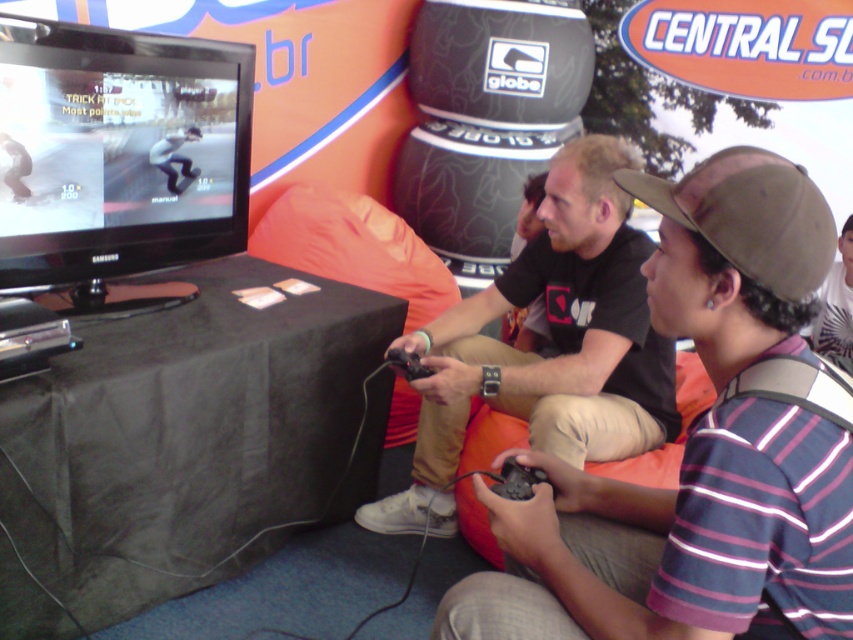
Which is above, black matte shirt at center or brown fabric baseball cap at center-right?

brown fabric baseball cap at center-right is higher up.

Find the location of a particular element. black matte shirt at center is located at coordinates (548, 344).

Is point (512, 387) positioned behind point (776, 200)?

Yes, it is behind point (776, 200).

At what (x,y) coordinates should I click in order to perform the action: click on black matte shirt at center. Please return your answer as a coordinate pair (x, y). Looking at the image, I should click on (548, 344).

Is striped cotton shirt at center positioned before black matte shirt at center?

That is True.

What do you see at coordinates (676, 541) in the screenshot?
I see `striped cotton shirt at center` at bounding box center [676, 541].

You are a GUI agent. You are given a task and a screenshot of the screen. Output one action in this format:
    pyautogui.click(x=<x>, y=<y>)
    Task: Click on the striped cotton shirt at center
    
    Given the screenshot: What is the action you would take?
    pyautogui.click(x=676, y=541)

Where is `striped cotton shirt at center`? striped cotton shirt at center is located at coordinates (676, 541).

Between point (793, 298) and point (654, 182), which one is positioned in front?

Positioned in front is point (793, 298).

Does point (762, 339) come closer to viewer compared to point (747, 177)?

No, it is not.

Which is behind, point (665, 257) or point (761, 182)?

Point (665, 257)

You are a GUI agent. You are given a task and a screenshot of the screen. Output one action in this format:
    pyautogui.click(x=<x>, y=<y>)
    Task: Click on the striped cotton shirt at center
    The image size is (853, 640).
    Given the screenshot: What is the action you would take?
    pyautogui.click(x=676, y=541)